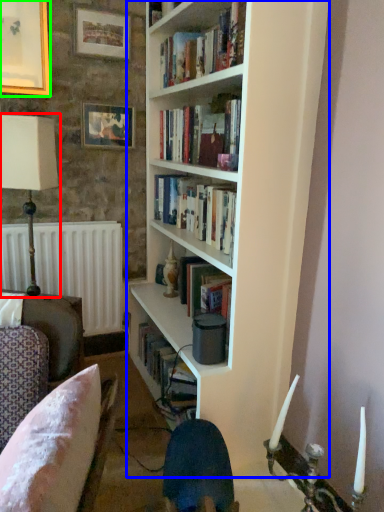
Question: Which object is positioned farthest from table lamp (highlighted by a red box)? Select from bookcase (highlighted by a blue box) and picture frame (highlighted by a green box).

Choices:
 (A) bookcase
 (B) picture frame

Answer: (A)